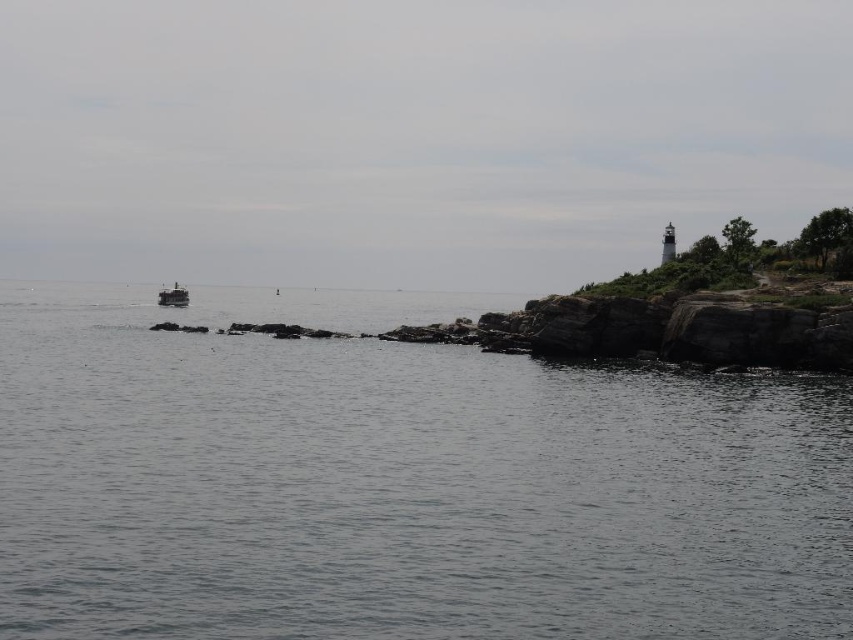
You are standing on the rocky coastline and want to estimate how far the gray water at center is from you. Based on the scene, what is the approximate distance?

The gray water at center is approximately 17.98 meters away from the camera, so it is about 18 meters away from you.

Looking at this image, you are a sailor on the metallic gray boat at left and you want to reach the lighthouse on the right. Based on the scene, which direction should you head to avoid the gray water at center?

The gray water at center is located below the metallic gray boat at left, so to avoid it, you should head towards the lighthouse on the right by steering the boat upwards away from the gray water at center.